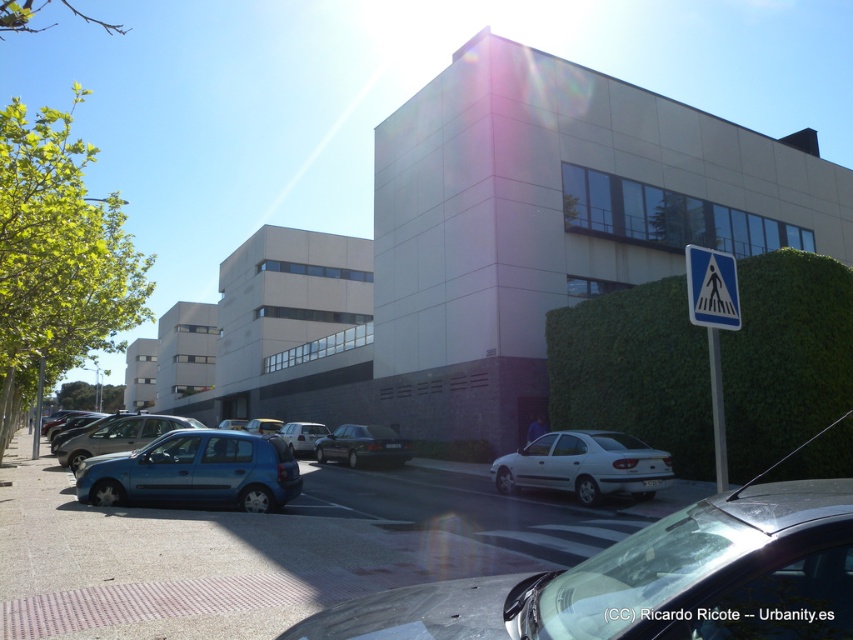
Question: Which object is positioned farthest from the metallic blue hatchback at lower left?

Choices:
 (A) silver metallic car at center
 (B) metallic silver car at center
 (C) blue metallic car at lower left
 (D) blue metallic hatchback at center

Answer: (B)

Question: Which is nearer to the silver metallic car at center?

Choices:
 (A) metallic blue hatchback at lower left
 (B) white plastic pedestrian crossing sign at lower right

Answer: (A)

Question: From the image, what is the correct spatial relationship of white plastic pedestrian crossing sign at lower right in relation to silver metallic car at center?

Choices:
 (A) right
 (B) left

Answer: (A)

Question: Which of the following is the closest to the observer?

Choices:
 (A) (77, 444)
 (B) (297, 426)
 (C) (367, 440)
 (D) (724, 301)

Answer: (D)

Question: Where is blue metallic hatchback at center located in relation to metallic silver car at center in the image?

Choices:
 (A) below
 (B) above

Answer: (B)

Question: Can you confirm if dark gray metallic car at center is positioned to the left of silver metallic car at center?

Choices:
 (A) no
 (B) yes

Answer: (A)